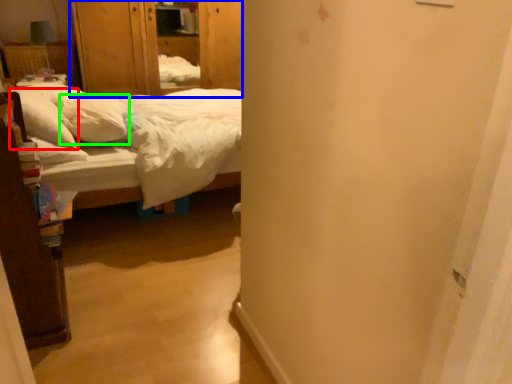
Question: Considering the real-world distances, which object is closest to pillow (highlighted by a red box)? armoire (highlighted by a blue box) or pillow (highlighted by a green box).

Choices:
 (A) armoire
 (B) pillow

Answer: (B)